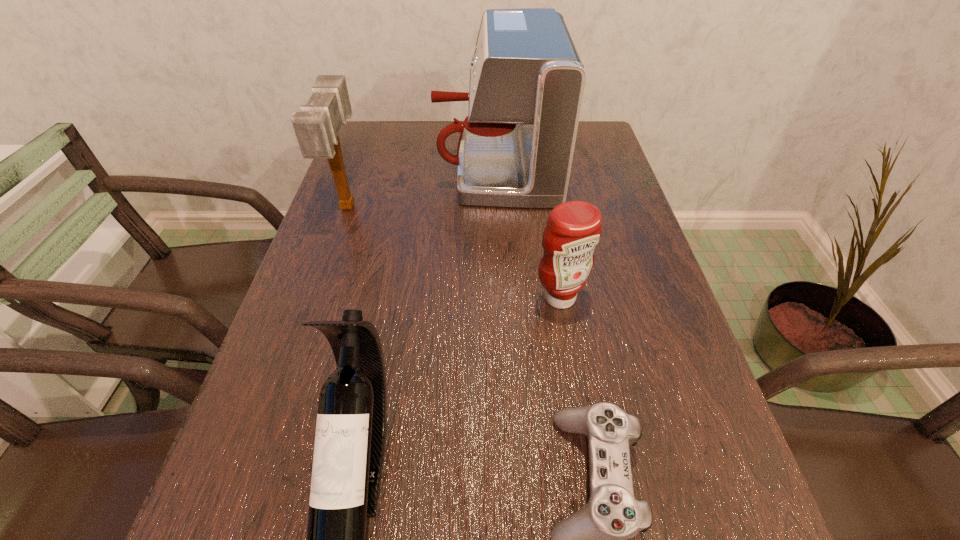
Identify which object is the closest to the control. Please provide its 2D coordinates. Your answer should be formatted as a tuple, i.e. [(x, y)], where the tuple contains the x and y coordinates of a point satisfying the conditions above.

[(574, 228)]

The image size is (960, 540). I want to click on free space that satisfies the following two spatial constraints: 1. on the front of the condiment near the spout; 2. on the left side of the coffee maker, so click(x=501, y=298).

This screenshot has height=540, width=960. What are the coordinates of `vacant space that satisfies the following two spatial constraints: 1. on the front of the fourth tallest object near the spout; 2. on the right side of the coffee maker` in the screenshot? It's located at (501, 298).

The height and width of the screenshot is (540, 960). I want to click on free location that satisfies the following two spatial constraints: 1. on the front of the third farthest object near the spout; 2. on the right side of the coffee maker, so click(501, 298).

Identify the location of vacant space that satisfies the following two spatial constraints: 1. on the front of the fourth tallest object near the spout; 2. on the right side of the coffee maker. (501, 298).

Identify the location of free region that satisfies the following two spatial constraints: 1. on the back side of the condiment; 2. on the front of the coffee maker near the spout. The height and width of the screenshot is (540, 960). (539, 168).